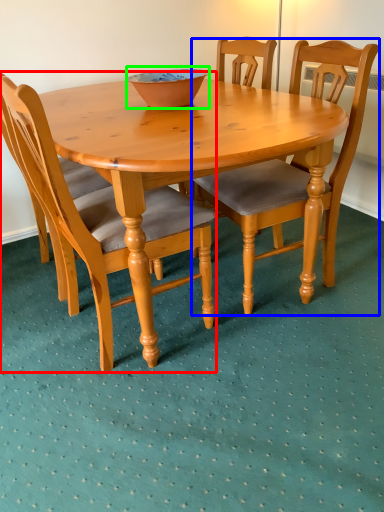
Question: Which object is the closest to the chair (highlighted by a red box)? Choose among these: chair (highlighted by a blue box) or bowl (highlighted by a green box).

Choices:
 (A) chair
 (B) bowl

Answer: (A)